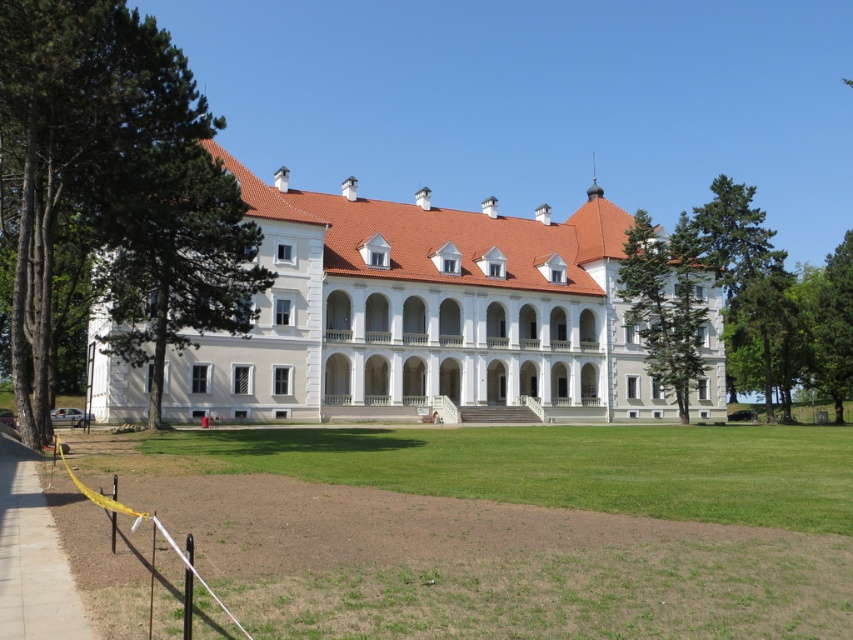
Based on the photo, you are standing at the point labeled as point (563, 467) in the image. What do you see directly below you?

At point (563, 467) lies green grass at center, so you would see green grass at center directly below you.

You are a landscape architect designing a new garden layout. You need to place a 5 meter wide statue between the green coniferous tree at right and the green textured tree at right. Is there enough space between them to fit the statue?

The green coniferous tree at right and green textured tree at right are 6.17 meters apart from each other. Since the statue is 5 meters wide, there is sufficient space between them to accommodate the statue.